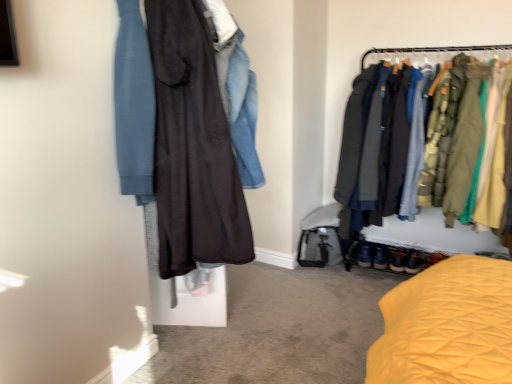
Question: Is leather brown shoes at lower right not within dark matte dress at center?

Choices:
 (A) no
 (B) yes

Answer: (B)

Question: Considering the relative sizes of leather brown shoes at lower right and dark matte dress at center in the image provided, is leather brown shoes at lower right smaller than dark matte dress at center?

Choices:
 (A) yes
 (B) no

Answer: (A)

Question: Is leather brown shoes at lower right taller than dark matte dress at center?

Choices:
 (A) no
 (B) yes

Answer: (A)

Question: From a real-world perspective, is leather brown shoes at lower right beneath dark matte dress at center?

Choices:
 (A) yes
 (B) no

Answer: (A)

Question: Is dark matte dress at center at the back of leather brown shoes at lower right?

Choices:
 (A) yes
 (B) no

Answer: (B)

Question: Is leather brown shoes at lower right not close to dark matte dress at center?

Choices:
 (A) no
 (B) yes

Answer: (B)

Question: Can you confirm if dark matte dress at center is smaller than leather brown shoes at lower right?

Choices:
 (A) yes
 (B) no

Answer: (B)

Question: Is dark matte dress at center turned away from leather brown shoes at lower right?

Choices:
 (A) no
 (B) yes

Answer: (A)

Question: Could leather brown shoes at lower right be considered to be inside dark matte dress at center?

Choices:
 (A) no
 (B) yes

Answer: (A)

Question: From the image's perspective, would you say dark matte dress at center is positioned over leather brown shoes at lower right?

Choices:
 (A) yes
 (B) no

Answer: (A)

Question: Would you consider dark matte dress at center to be distant from leather brown shoes at lower right?

Choices:
 (A) no
 (B) yes

Answer: (B)

Question: Is dark matte dress at center positioned behind leather brown shoes at lower right?

Choices:
 (A) yes
 (B) no

Answer: (B)

Question: Does textured fabric jackets at right turn towards dark matte dress at center?

Choices:
 (A) yes
 (B) no

Answer: (A)